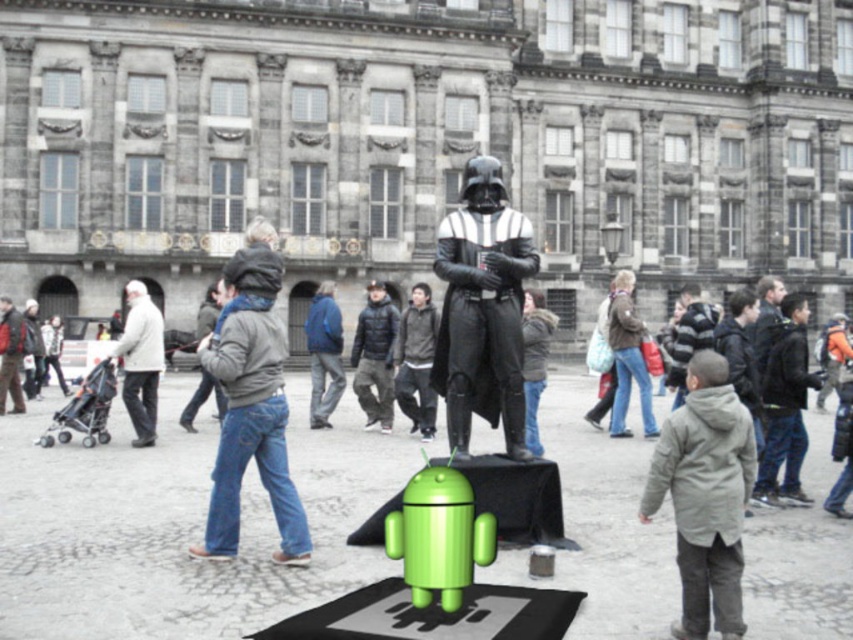
You are a tailor observing a public square scene with a Darth Vader statue. You notice a white woolen coat at left and a dark gray jacket at center. Which clothing item is taller?

The white woolen coat at left is much taller than the dark gray jacket at center.